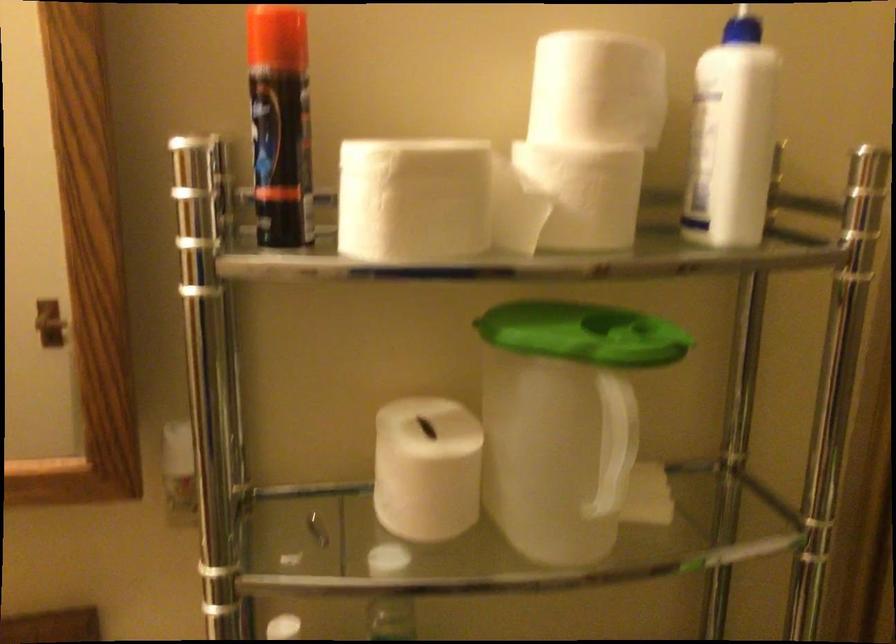
Where would you press the aerosol can nozzle? Please return your answer as a coordinate pair (x, y).

(731, 137)